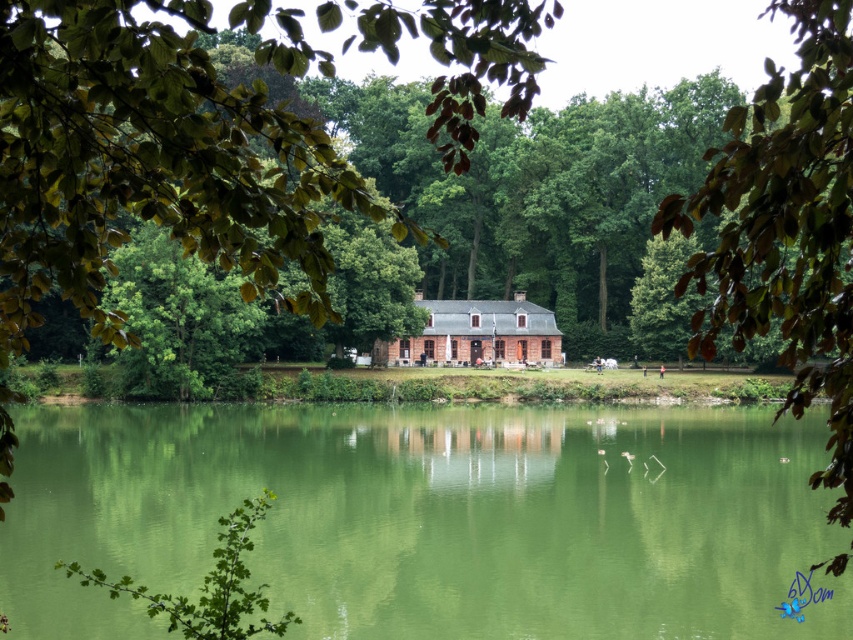
Does point (558, 561) come in front of point (799, 141)?

No, (558, 561) is behind (799, 141).

What are the coordinates of `green smooth water at center` in the screenshot? It's located at 430,518.

Where is `green smooth water at center`? Image resolution: width=853 pixels, height=640 pixels. green smooth water at center is located at coordinates (430, 518).

Is point (85, 602) more distant than point (444, 337)?

No, (85, 602) is closer to viewer.

Is point (764, 461) in front of point (438, 332)?

Yes, point (764, 461) is closer to viewer.

Which is in front, point (415, 472) or point (474, 326)?

Point (415, 472)

The height and width of the screenshot is (640, 853). Find the location of `green smooth water at center`. green smooth water at center is located at coordinates (430, 518).

Is point (850, 372) in front of point (521, 310)?

Yes, point (850, 372) is closer to viewer.

How far apart are green leafy tree at upper right and brown brick cottage at center?

green leafy tree at upper right is 40.99 meters away from brown brick cottage at center.

Locate an element on the screen. The image size is (853, 640). green leafy tree at upper right is located at coordinates (786, 227).